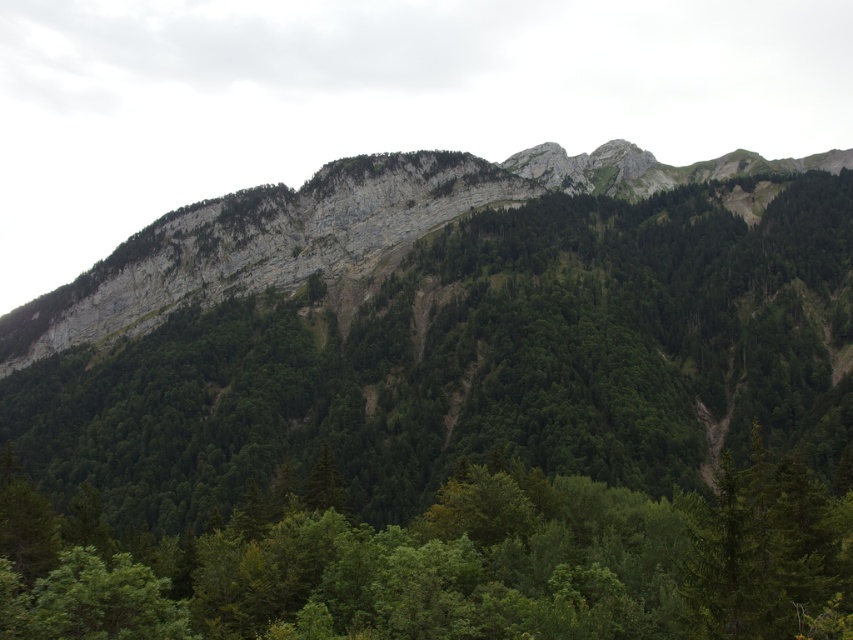
Question: Does green matte tree at lower center appear over green rock at center?

Choices:
 (A) yes
 (B) no

Answer: (B)

Question: Is green matte tree at lower center wider than green rock at center?

Choices:
 (A) yes
 (B) no

Answer: (B)

Question: Does green matte tree at lower center have a lesser width compared to green rock at center?

Choices:
 (A) no
 (B) yes

Answer: (B)

Question: Which point is farther to the camera?

Choices:
 (A) (613, 152)
 (B) (364, 577)

Answer: (A)